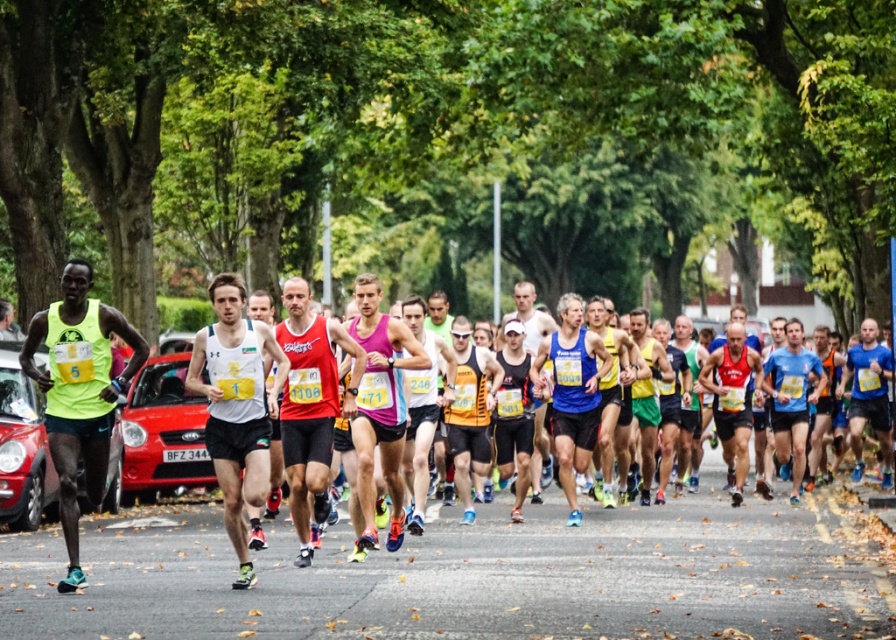
Question: Is the position of neon yellow fabric at left less distant than that of blue fabric shorts at center?

Choices:
 (A) yes
 (B) no

Answer: (A)

Question: Which is farther from the pink fabric tank top at center?

Choices:
 (A) blue fabric shorts at center
 (B) black mesh tank top at center
 (C) blue fabric shirt at center
 (D) neon yellow fabric at left

Answer: (A)

Question: Is blue fabric shorts at center closer to camera compared to black mesh tank top at center?

Choices:
 (A) no
 (B) yes

Answer: (A)

Question: Among these points, which one is farthest from the camera?

Choices:
 (A) (791, 333)
 (B) (856, 472)

Answer: (B)

Question: Is the position of neon yellow fabric at left more distant than that of black mesh tank top at center?

Choices:
 (A) no
 (B) yes

Answer: (A)

Question: Which is nearer to the black mesh tank top at center?

Choices:
 (A) neon yellow fabric at left
 (B) blue fabric shorts at center
 (C) blue fabric shirt at center
 (D) pink fabric tank top at center

Answer: (C)